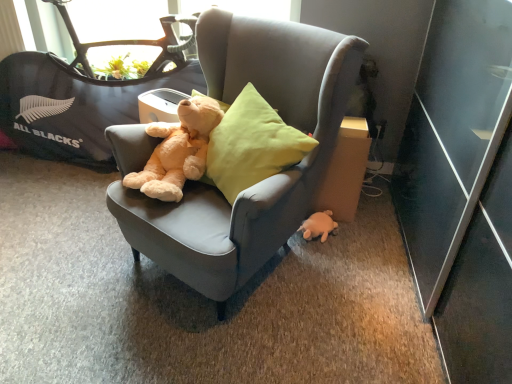
This screenshot has height=384, width=512. I want to click on vacant space situated on the left part of velvet gray chair at center, so click(x=64, y=254).